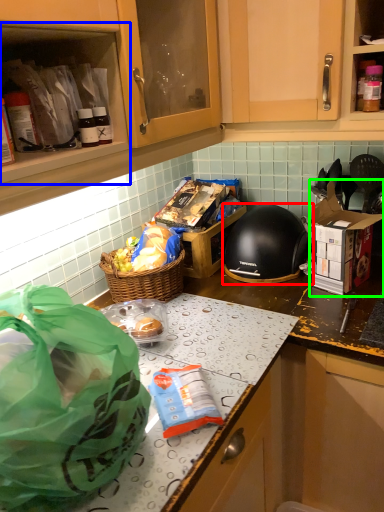
Question: Estimate the real-world distances between objects in this image. Which object is farther from helmet (highlighted by a red box), cabinetry (highlighted by a blue box) or cardboard box (highlighted by a green box)?

Choices:
 (A) cabinetry
 (B) cardboard box

Answer: (A)